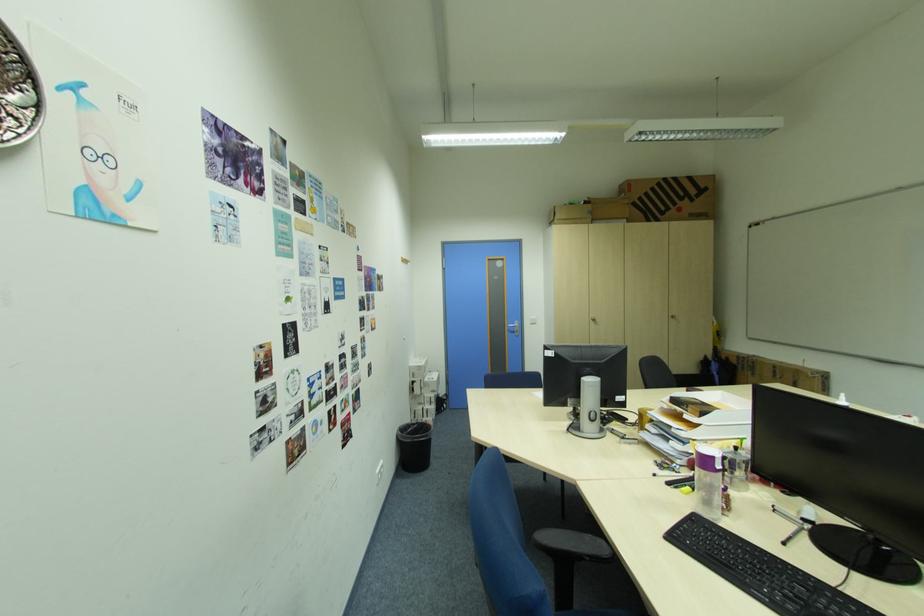
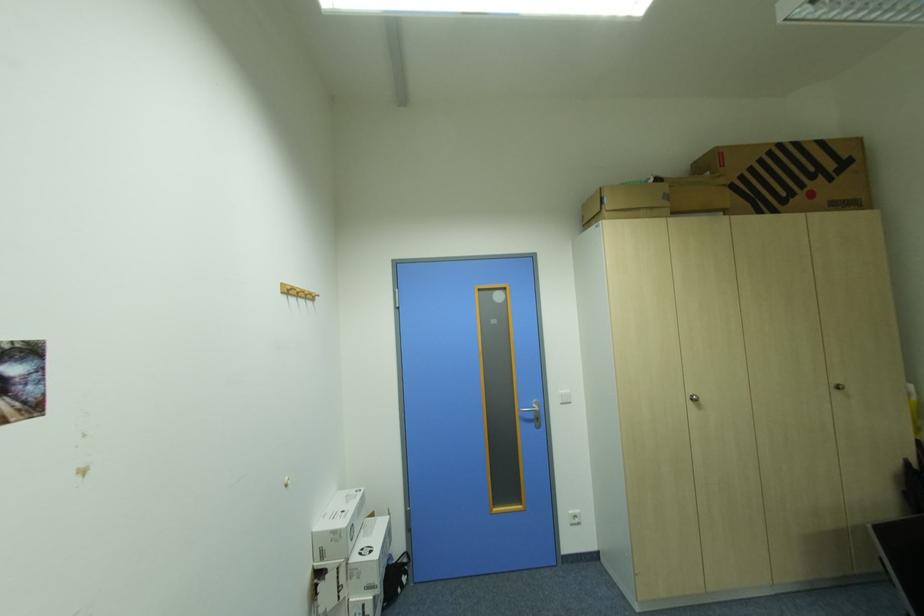
The point at (441, 392) is marked in the first image. Where is the corresponding point in the second image?

(377, 590)